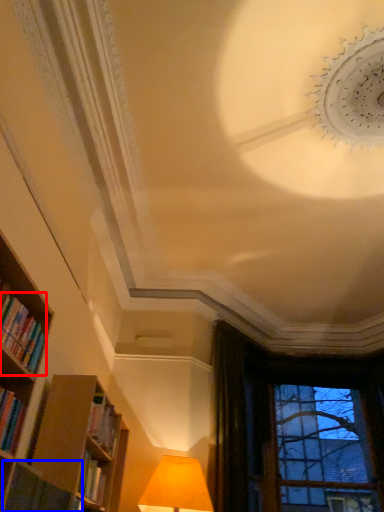
Question: Among these objects, which one is nearest to the camera, book (highlighted by a red box) or book (highlighted by a blue box)?

Choices:
 (A) book
 (B) book

Answer: (A)